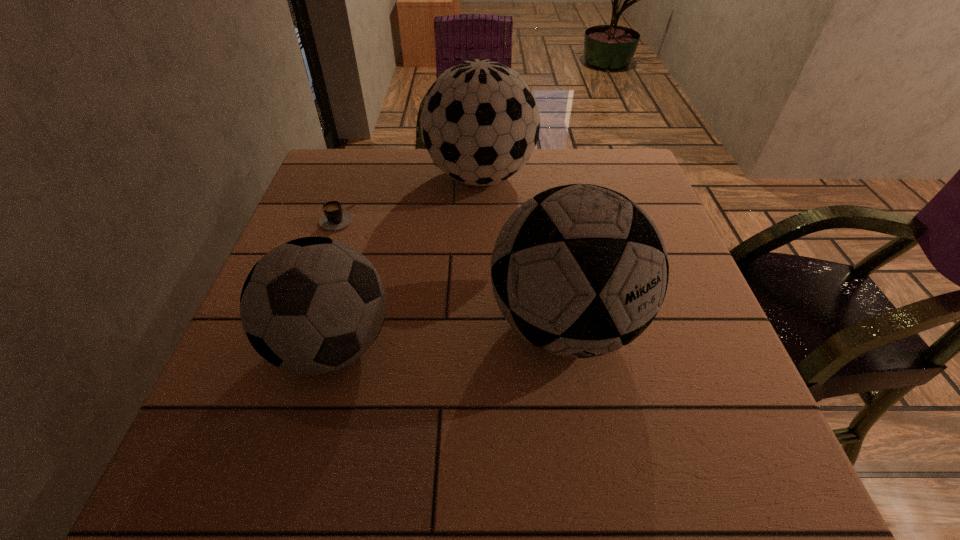
This screenshot has width=960, height=540. Find the location of `vacant point located between the second shortest object and the farthest soccer ball`. vacant point located between the second shortest object and the farthest soccer ball is located at coordinates (406, 261).

The width and height of the screenshot is (960, 540). What are the coordinates of `unoccupied area between the cappuccino and the farthest soccer ball` in the screenshot? It's located at (409, 197).

This screenshot has width=960, height=540. Find the location of `object that is the second closest one to the cappuccino`. object that is the second closest one to the cappuccino is located at coordinates (313, 305).

Find the location of a particular element. object that is the third closest to the farthest soccer ball is located at coordinates (313, 305).

What are the coordinates of `soccer ball that is the nearest to the shortest object` in the screenshot? It's located at (480, 122).

At what (x,y) coordinates should I click in order to perform the action: click on soccer ball that stands as the closest to the shortest soccer ball. Please return your answer as a coordinate pair (x, y). The width and height of the screenshot is (960, 540). Looking at the image, I should click on (579, 270).